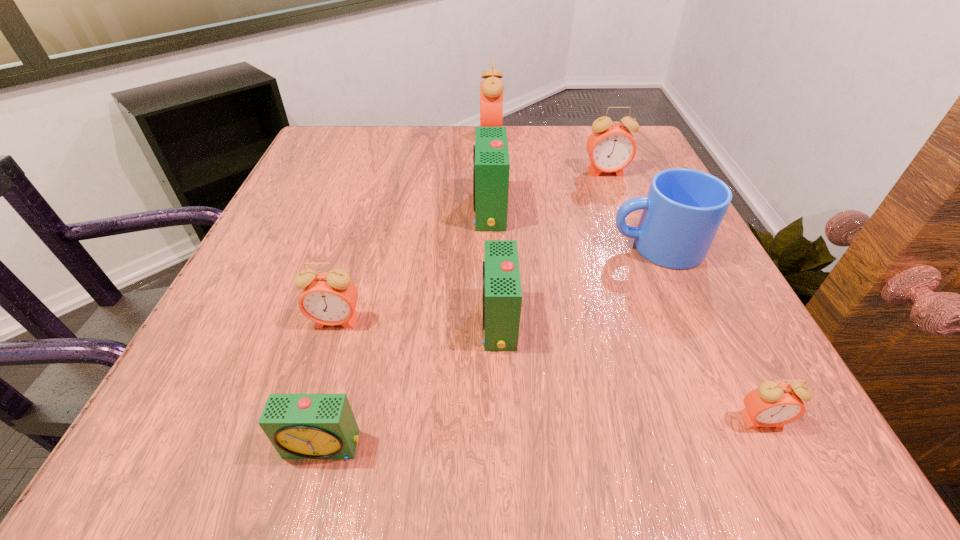
Image resolution: width=960 pixels, height=540 pixels. In order to click on the nearest pink alarm clock in this screenshot , I will do [772, 404].

At what (x,y) coordinates should I click in order to perform the action: click on the smallest pink alarm clock. Please return your answer as a coordinate pair (x, y). Image resolution: width=960 pixels, height=540 pixels. Looking at the image, I should click on (772, 404).

You are a GUI agent. You are given a task and a screenshot of the screen. Output one action in this format:
    pyautogui.click(x=<x>, y=<y>)
    Task: Click on the nearest alarm clock
    This screenshot has height=540, width=960.
    Given the screenshot: What is the action you would take?
    pyautogui.click(x=300, y=426)

Where is `the nearest green alarm clock`? the nearest green alarm clock is located at coordinates (300, 426).

This screenshot has width=960, height=540. Identify the location of free location located on the face of the second pink alarm clock from left to right. (336, 134).

Locate an element on the screen. The width and height of the screenshot is (960, 540). vacant space located on the face of the second pink alarm clock from left to right is located at coordinates (441, 134).

What are the coordinates of `vacant space located on the face of the second pink alarm clock from left to right` in the screenshot? It's located at (410, 134).

I want to click on free space located 0.070m on the face of the third nearest pink alarm clock, so click(614, 195).

Where is `vacant region located on the front-facing side of the third farthest alarm clock`? This screenshot has width=960, height=540. vacant region located on the front-facing side of the third farthest alarm clock is located at coordinates (390, 211).

Where is `vacant space located 0.200m on the front-facing side of the third farthest alarm clock`? vacant space located 0.200m on the front-facing side of the third farthest alarm clock is located at coordinates (375, 211).